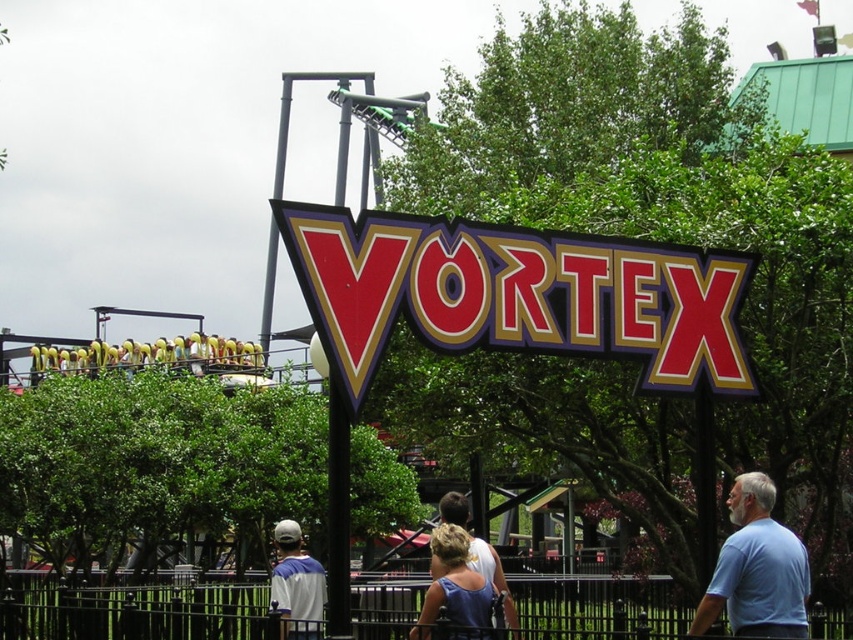
Question: Considering the relative positions of shiny red sign at center and black metal fence at lower center in the image provided, where is shiny red sign at center located with respect to black metal fence at lower center?

Choices:
 (A) left
 (B) right

Answer: (B)

Question: Can you confirm if shiny red sign at center is positioned to the right of light blue t-shirt at lower right?

Choices:
 (A) no
 (B) yes

Answer: (A)

Question: Can you confirm if black metal fence at lower center is positioned above light blue t-shirt at lower right?

Choices:
 (A) no
 (B) yes

Answer: (A)

Question: Which point appears closest to the camera in this image?

Choices:
 (A) (753, 582)
 (B) (428, 620)

Answer: (B)

Question: Which is nearer to the shiny red sign at center?

Choices:
 (A) black metal fence at lower center
 (B) light blue t-shirt at lower right

Answer: (B)

Question: Which point is closer to the camera?

Choices:
 (A) (352, 618)
 (B) (466, 317)

Answer: (B)